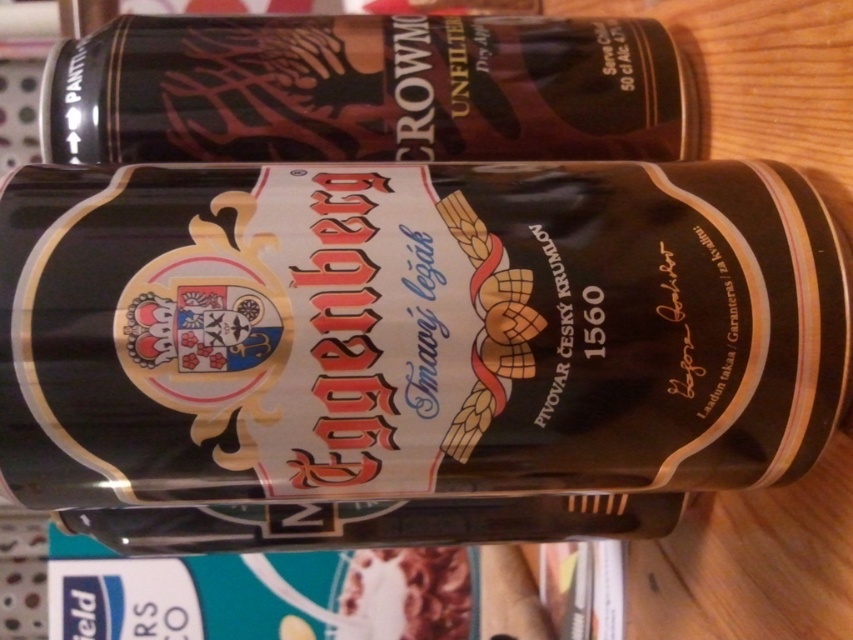
You are a bartender preparing a drink order. You have two cans in front of you on the counter. The metallic gold beer can at center and the matte black can at upper center. Which can should you choose if the customer requested the taller one?

The metallic gold beer can at center is taller than the matte black can at upper center, so you should choose the metallic gold beer can at center.

You are a bartender arranging drinks on a shelf. You have a metallic gold beer can at center and a matte black can at upper center. Which can requires more horizontal space on the shelf?

The metallic gold beer can at center requires more horizontal space on the shelf because its width is larger than the matte black can at upper center.

You are at a bar and want to order the larger beer can. Which one should you point to between the metallic gold beer can at center and the matte black can at upper center?

The metallic gold beer can at center is larger than the matte black can at upper center, so you should point to the metallic gold beer can at center.